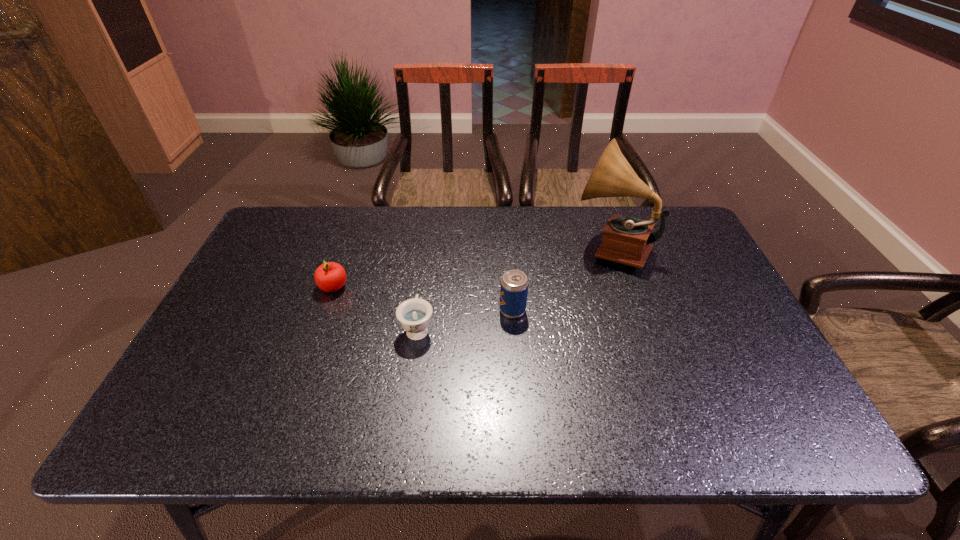
Find the location of `free space located 0.210m on the horn of the tallest object`. free space located 0.210m on the horn of the tallest object is located at coordinates (503, 247).

Locate an element on the screen. The image size is (960, 540). vacant space located 0.130m on the left of the second object from right to left is located at coordinates (451, 310).

Where is `vacant space situated on the right of the apple`? This screenshot has width=960, height=540. vacant space situated on the right of the apple is located at coordinates (480, 287).

Identify the location of vacant region located on the side of the shortest object with the handle. (422, 295).

Image resolution: width=960 pixels, height=540 pixels. Identify the location of vacant space located 0.130m on the side of the shortest object with the handle. (424, 278).

This screenshot has width=960, height=540. Find the location of `blank space located 0.310m on the side of the shortest object with the handle`. blank space located 0.310m on the side of the shortest object with the handle is located at coordinates (430, 240).

Find the location of `object positioned at the far edge`. object positioned at the far edge is located at coordinates (627, 240).

You are a GUI agent. You are given a task and a screenshot of the screen. Output one action in this format:
    pyautogui.click(x=<x>, y=<y>)
    Task: Click on the object located in the right edge section of the desktop
    This screenshot has height=540, width=960.
    Given the screenshot: What is the action you would take?
    pyautogui.click(x=627, y=240)

This screenshot has height=540, width=960. In order to click on object that is at the far right corner in this screenshot , I will do `click(627, 240)`.

I want to click on free point at the far edge, so click(x=505, y=211).